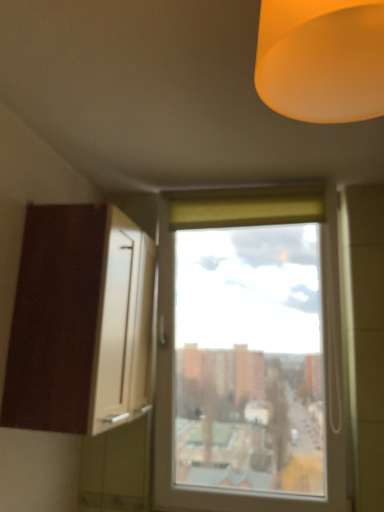
You are a GUI agent. You are given a task and a screenshot of the screen. Output one action in this format:
    pyautogui.click(x=<x>, y=<y>)
    Task: Click on the brown matte cabinet at left
    The height and width of the screenshot is (512, 384).
    Given the screenshot: What is the action you would take?
    [80, 321]

Measure the distance between brown matte cabinet at left and camera.

brown matte cabinet at left and camera are 4.24 feet apart from each other.

This screenshot has height=512, width=384. Describe the element at coordinates (80, 321) in the screenshot. I see `brown matte cabinet at left` at that location.

You are a GUI agent. You are given a task and a screenshot of the screen. Output one action in this format:
    pyautogui.click(x=<x>, y=<y>)
    Task: Click on the brown matte cabinet at left
    This screenshot has width=384, height=512.
    Given the screenshot: What is the action you would take?
    pyautogui.click(x=80, y=321)